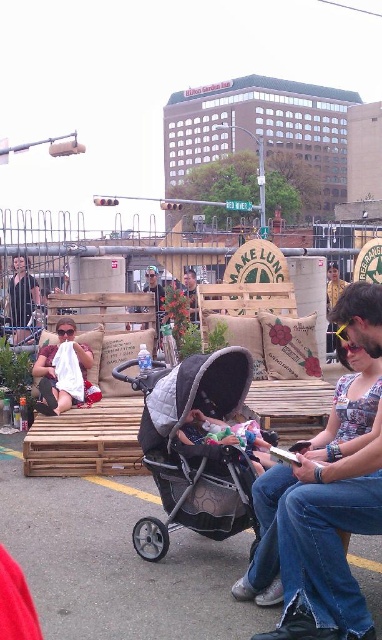
Question: Observing the image, what is the correct spatial positioning of white cloth at center in reference to soft pink fabric at center?

Choices:
 (A) right
 (B) left

Answer: (B)

Question: Which object is positioned farthest from the soft pink fabric at center?

Choices:
 (A) denim jeans at lower right
 (B) brown leather jacket at center
 (C) denim jacket at center

Answer: (B)

Question: Which of these objects is positioned closest to the denim jeans at lower right?

Choices:
 (A) white cloth at center
 (B) matte black t-shirt at left

Answer: (A)

Question: Among these objects, which one is farthest from the camera?

Choices:
 (A) denim jeans at lower right
 (B) white cloth at center
 (C) matte black t-shirt at left
 (D) denim jacket at center

Answer: (D)

Question: Does black quilted fabric stroller at center appear under white cloth at center?

Choices:
 (A) yes
 (B) no

Answer: (A)

Question: Does white cloth at center appear on the right side of matte black t-shirt at left?

Choices:
 (A) yes
 (B) no

Answer: (A)